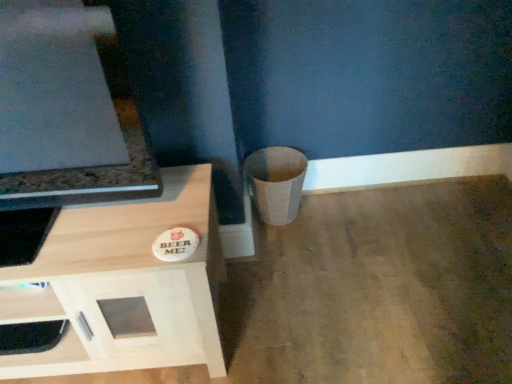
Find the location of a particular element. Image resolution: width=512 pixels, height=384 pixels. vacant location below matte beige trash can at lower right (from a real-world perspective) is located at coordinates (289, 222).